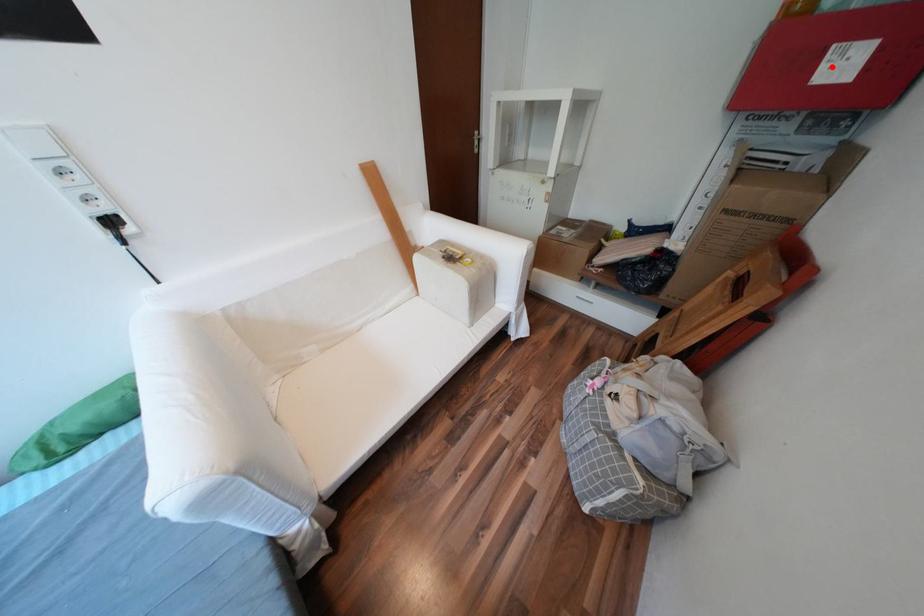
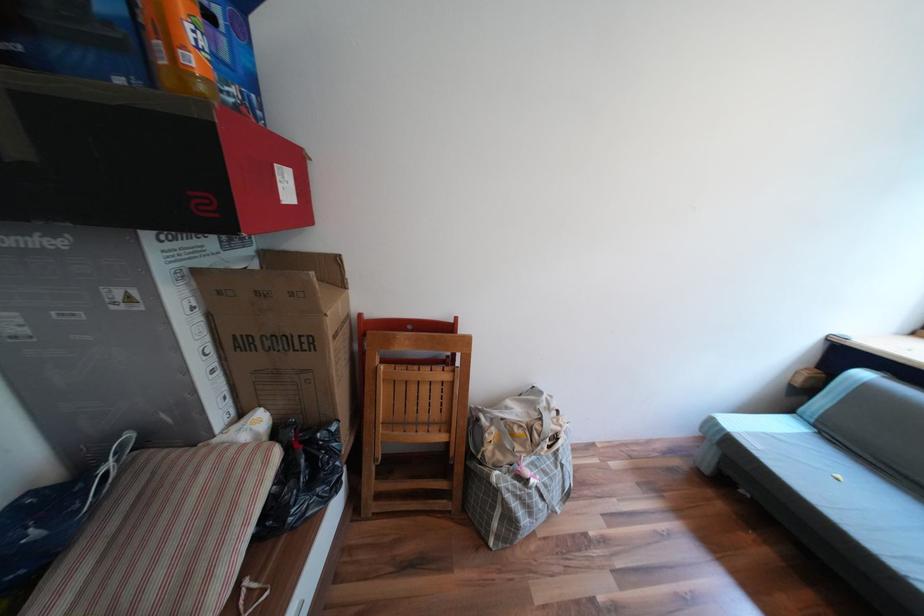
Question: A red point is marked in image1. In image2, is the corresponding 3D point closer to the camera or farther? Reply with the corresponding letter.

Choices:
 (A) The corresponding 3D point is closer.
 (B) The corresponding 3D point is farther.

Answer: (A)